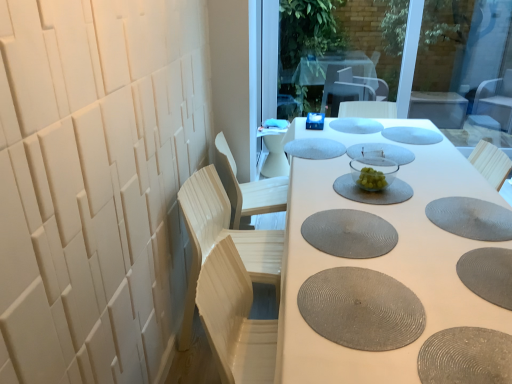
Question: Would you say gray textured placemat at center, which is counted as the fourth manhole cover, starting from the front, contains transparent glass window screen at upper center?

Choices:
 (A) yes
 (B) no

Answer: (B)

Question: Is gray textured placemat at center, placed as the seventh manhole cover when sorted from back to front, positioned behind transparent glass window screen at upper center?

Choices:
 (A) yes
 (B) no

Answer: (B)

Question: Is gray textured placemat at center, which is counted as the fourth manhole cover, starting from the front, smaller than transparent glass window screen at upper center?

Choices:
 (A) yes
 (B) no

Answer: (A)

Question: From a real-world perspective, does gray textured placemat at center, placed as the seventh manhole cover when sorted from back to front, sit lower than transparent glass window screen at upper center?

Choices:
 (A) no
 (B) yes

Answer: (B)

Question: Is gray textured placemat at center, which is counted as the fourth manhole cover, starting from the front, closer to the viewer compared to transparent glass window screen at upper center?

Choices:
 (A) yes
 (B) no

Answer: (A)

Question: Is point (460, 210) closer or farther from the camera than point (390, 134)?

Choices:
 (A) closer
 (B) farther

Answer: (A)

Question: Do you think gray textured placemat at lower right, the 6th manhole cover in the back-to-front sequence, is within gray rubber mat at center, which appears as the 9th manhole cover when viewed from the front, or outside of it?

Choices:
 (A) inside
 (B) outside

Answer: (B)

Question: From a real-world perspective, relative to gray rubber mat at center, which appears as the 2th manhole cover when viewed from the back, is gray textured placemat at lower right, which is the fifth manhole cover from front to back, vertically above or below?

Choices:
 (A) above
 (B) below

Answer: (B)

Question: Looking at their shapes, would you say gray textured placemat at lower right, the 6th manhole cover in the back-to-front sequence, is wider or thinner than gray rubber mat at center, which appears as the 9th manhole cover when viewed from the front?

Choices:
 (A) thin
 (B) wide

Answer: (A)

Question: From the image's perspective, is light wood swivel chair at left located above or below clear glass bowl at center, placed as the seventh manhole cover when sorted from front to back?

Choices:
 (A) below
 (B) above

Answer: (A)

Question: Considering the positions of light wood swivel chair at left and clear glass bowl at center, which is the fourth manhole cover in back-to-front order, in the image, is light wood swivel chair at left taller or shorter than clear glass bowl at center, which is the fourth manhole cover in back-to-front order,?

Choices:
 (A) short
 (B) tall

Answer: (B)

Question: Considering the positions of point (263, 377) and point (351, 147), is point (263, 377) closer or farther from the camera than point (351, 147)?

Choices:
 (A) closer
 (B) farther

Answer: (A)

Question: Visually, is light wood swivel chair at left positioned to the left or to the right of clear glass bowl at center, which is the fourth manhole cover in back-to-front order?

Choices:
 (A) left
 (B) right

Answer: (A)

Question: From the image's perspective, is light wood swivel chair at left located above or below textured gray manhole cover at lower right, which is the 10th manhole cover from back to front?

Choices:
 (A) below
 (B) above

Answer: (A)

Question: From a real-world perspective, is light wood swivel chair at left positioned above or below textured gray manhole cover at lower right, the first manhole cover from the front?

Choices:
 (A) below
 (B) above

Answer: (A)